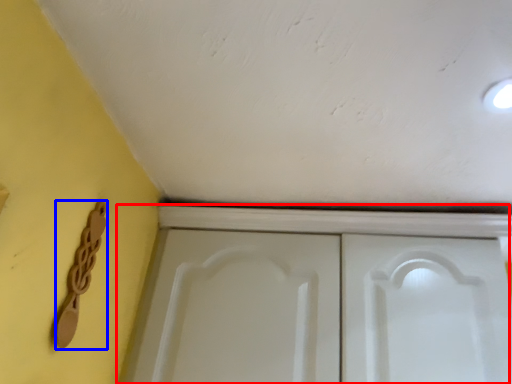
Question: Which object appears farthest to the camera in this image, cupboard (highlighted by a red box) or door handle (highlighted by a blue box)?

Choices:
 (A) cupboard
 (B) door handle

Answer: (A)